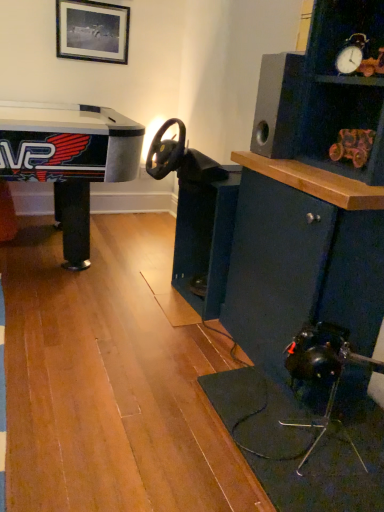
Image resolution: width=384 pixels, height=512 pixels. Find the location of `unoccupied area in front of dark blue wood cabinet at center`. unoccupied area in front of dark blue wood cabinet at center is located at coordinates (192, 334).